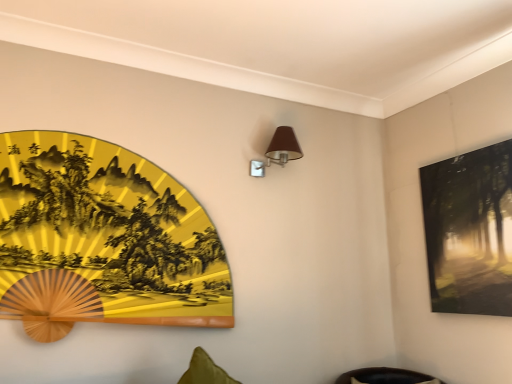
Question: Can we say matte black painting at upper right, which is the first picture frame from right to left, lies outside brown fabric table lamp at upper center?

Choices:
 (A) yes
 (B) no

Answer: (A)

Question: Can you confirm if matte black painting at upper right, placed as the second picture frame when sorted from left to right, is shorter than brown fabric table lamp at upper center?

Choices:
 (A) yes
 (B) no

Answer: (B)

Question: Does matte black painting at upper right, placed as the second picture frame when sorted from left to right, appear on the left side of brown fabric table lamp at upper center?

Choices:
 (A) yes
 (B) no

Answer: (B)

Question: From the image's perspective, does matte black painting at upper right, which is the first picture frame from right to left, appear lower than brown fabric table lamp at upper center?

Choices:
 (A) no
 (B) yes

Answer: (B)

Question: From a real-world perspective, is matte black painting at upper right, which is the first picture frame from right to left, over brown fabric table lamp at upper center?

Choices:
 (A) no
 (B) yes

Answer: (A)

Question: Does matte black painting at upper right, which is the first picture frame from right to left, have a smaller size compared to brown fabric table lamp at upper center?

Choices:
 (A) yes
 (B) no

Answer: (B)

Question: Is there a large distance between matte black painting at upper right, placed as the second picture frame when sorted from left to right, and gold lacquered fan at left, the 1th picture frame from the left?

Choices:
 (A) no
 (B) yes

Answer: (B)

Question: From a real-world perspective, is matte black painting at upper right, which is the first picture frame from right to left, under gold lacquered fan at left, the 2th picture frame from the right?

Choices:
 (A) no
 (B) yes

Answer: (A)

Question: Is matte black painting at upper right, which is the first picture frame from right to left, in front of gold lacquered fan at left, the 2th picture frame from the right?

Choices:
 (A) no
 (B) yes

Answer: (A)

Question: Is matte black painting at upper right, which is the first picture frame from right to left, further to the viewer compared to gold lacquered fan at left, the 2th picture frame from the right?

Choices:
 (A) no
 (B) yes

Answer: (B)

Question: Is matte black painting at upper right, placed as the second picture frame when sorted from left to right, taller than gold lacquered fan at left, the 2th picture frame from the right?

Choices:
 (A) yes
 (B) no

Answer: (B)

Question: Does matte black painting at upper right, which is the first picture frame from right to left, turn towards gold lacquered fan at left, the 2th picture frame from the right?

Choices:
 (A) yes
 (B) no

Answer: (A)

Question: Does gold lacquered fan at left, the 2th picture frame from the right, have a greater width compared to brown fabric table lamp at upper center?

Choices:
 (A) yes
 (B) no

Answer: (B)